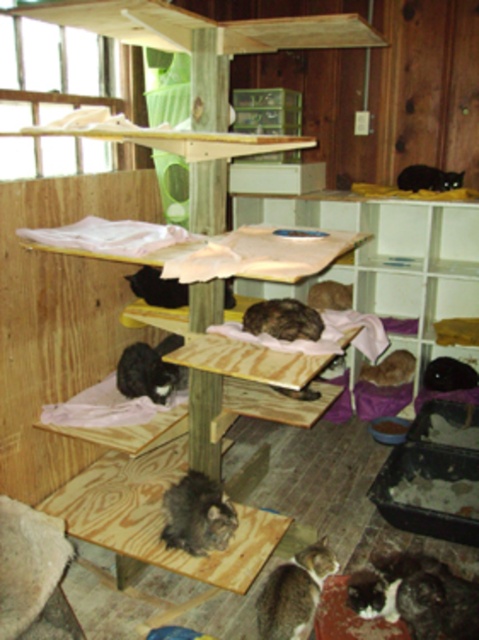
You are a cat owner who wants to place a new toy on the wooden platform at center so that your black fur cat at center can easily reach it. Based on the scene description, is the toy placement feasible?

The wooden platform at center is below the black fur cat at center, so the toy placed there would be easily accessible to the cat.

You are a cat trying to jump onto a platform located at point (458, 611). If your maximum jump height is 5 feet, can you reach the platform?

The distance of point (458, 611) from camera is 6.39 feet, so the cat cannot reach the platform since its maximum jump height is only 5 feet.